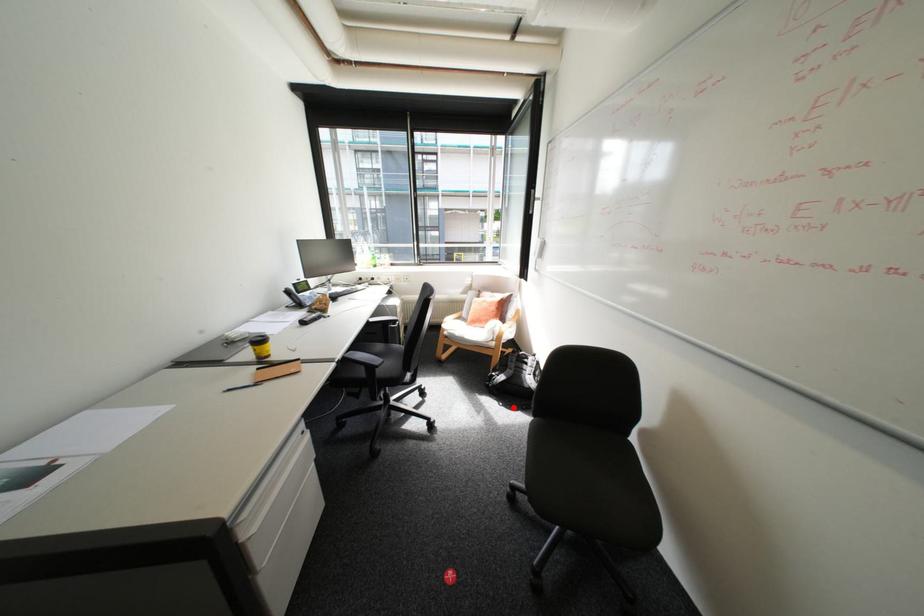
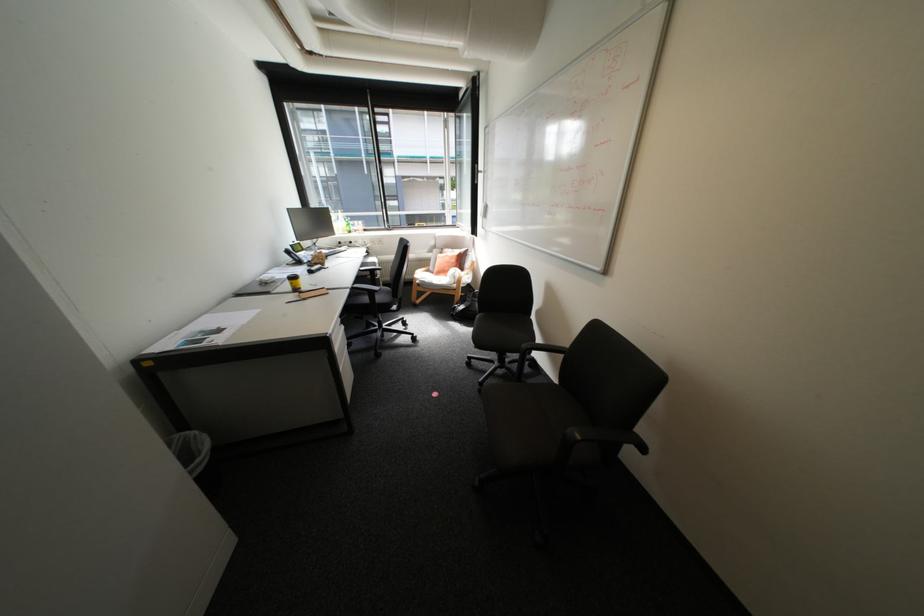
In the second image, find the point that corresponds to the highlighted location in the first image.

(473, 326)